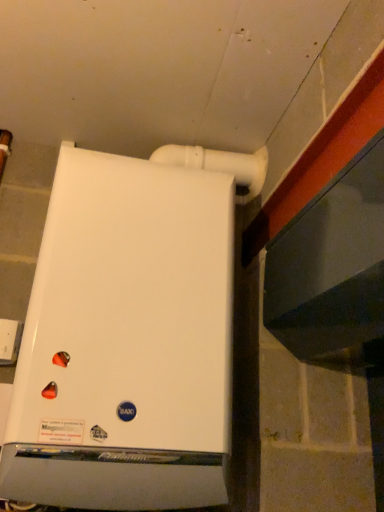
I want to click on white glossy boiler at center, so click(x=126, y=341).

The height and width of the screenshot is (512, 384). What do you see at coordinates (126, 341) in the screenshot?
I see `white glossy boiler at center` at bounding box center [126, 341].

You are a GUI agent. You are given a task and a screenshot of the screen. Output one action in this format:
    pyautogui.click(x=<x>, y=<y>)
    Task: Click on the white glossy boiler at center
    
    Given the screenshot: What is the action you would take?
    pyautogui.click(x=126, y=341)